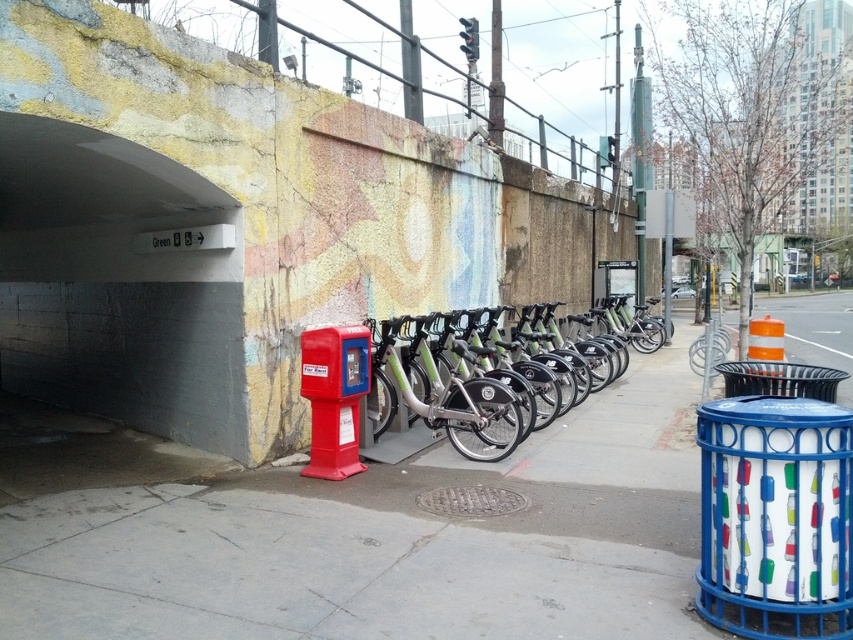
Does matte red phone box at center have a larger size compared to silver metallic bicycle at center?

Indeed, matte red phone box at center has a larger size compared to silver metallic bicycle at center.

Who is higher up, matte red phone box at center or silver metallic bicycle at center?

matte red phone box at center is higher up.

This screenshot has width=853, height=640. Identify the location of matte red phone box at center. (334, 396).

Between point (660, 509) and point (311, 436), which one is positioned behind?

The point (311, 436) is behind.

Where is `gray concrete sidewalk at center`? The height and width of the screenshot is (640, 853). gray concrete sidewalk at center is located at coordinates (390, 540).

Which is in front, point (167, 598) or point (328, 397)?

Point (167, 598)

Image resolution: width=853 pixels, height=640 pixels. I want to click on gray concrete sidewalk at center, so click(390, 540).

Between gray concrete sidewalk at center and silver metallic bicycle at center, which one appears on the left side from the viewer's perspective?

silver metallic bicycle at center is more to the left.

Describe the element at coordinates (390, 540) in the screenshot. I see `gray concrete sidewalk at center` at that location.

Between point (276, 570) and point (409, 442), which one is positioned behind?

The point (409, 442) is more distant.

Image resolution: width=853 pixels, height=640 pixels. I want to click on gray concrete sidewalk at center, so click(390, 540).